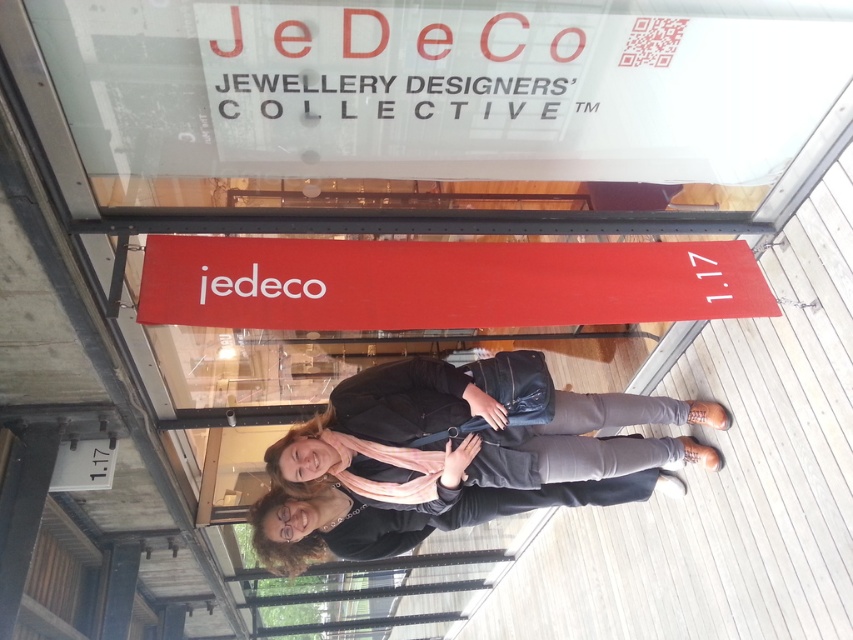
You are a photographer adjusting your camera settings to capture the storefront scene. You need to ensure both the red matte sign at center and the matte black jacket at center are in focus. Considering their sizes, which object should you prioritize focusing on first to ensure proper depth of field?

The red matte sign at center is wider than the matte black jacket at center. Since the red matte sign at center is larger, you should prioritize focusing on it first to ensure proper depth of field, as larger objects often require more precise focus adjustments.